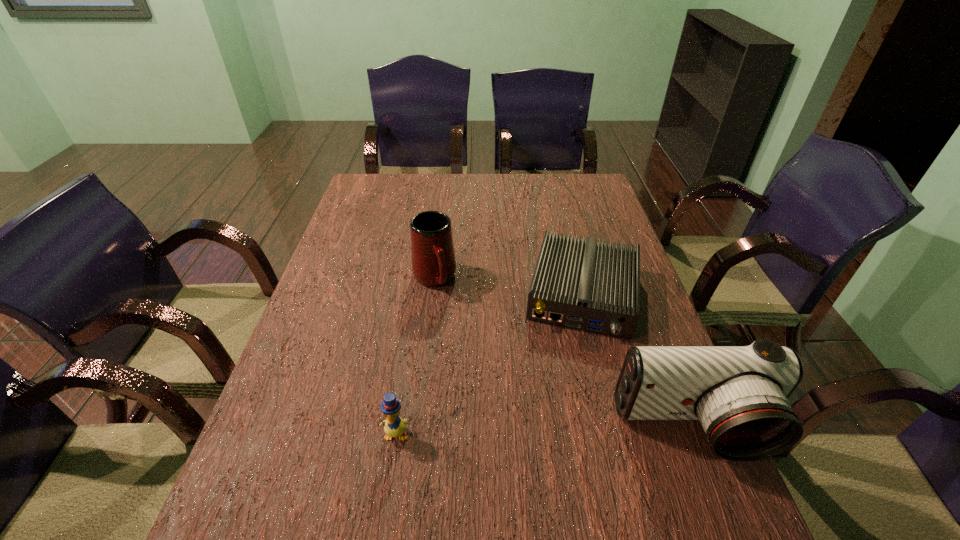
The height and width of the screenshot is (540, 960). Find the location of `free space on the desktop that is between the duckling and the camcorder and is positioned on the side of the mug with the handle`. free space on the desktop that is between the duckling and the camcorder and is positioned on the side of the mug with the handle is located at coordinates (502, 432).

The height and width of the screenshot is (540, 960). Find the location of `free spot on the desktop that is between the duckling and the camcorder and is positioned on the back panel of the router`. free spot on the desktop that is between the duckling and the camcorder and is positioned on the back panel of the router is located at coordinates (563, 431).